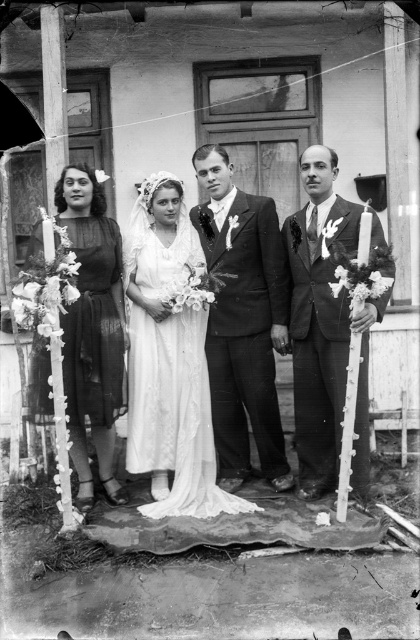
Locate an element on the screen. smooth black suit at center is located at coordinates (243, 321).

Between smooth black suit at center and smooth black suit at right, which one is positioned lower?

smooth black suit at right

This screenshot has height=640, width=420. Describe the element at coordinates (243, 321) in the screenshot. I see `smooth black suit at center` at that location.

I want to click on smooth black suit at center, so click(x=243, y=321).

Is point (343, 310) more distant than point (70, 182)?

No.

The width and height of the screenshot is (420, 640). Identify the location of smooth black suit at right. (325, 330).

Where is `smooth black suit at right`? The width and height of the screenshot is (420, 640). smooth black suit at right is located at coordinates (325, 330).

Identify the location of smooth black suit at right. (325, 330).

Measure the distance between white satin dress at center and smooth black suit at right.

They are 75.74 centimeters apart.

Is white satin dress at center wider than smooth black suit at right?

Yes.

Locate an element on the screen. This screenshot has width=420, height=640. white satin dress at center is located at coordinates (170, 356).